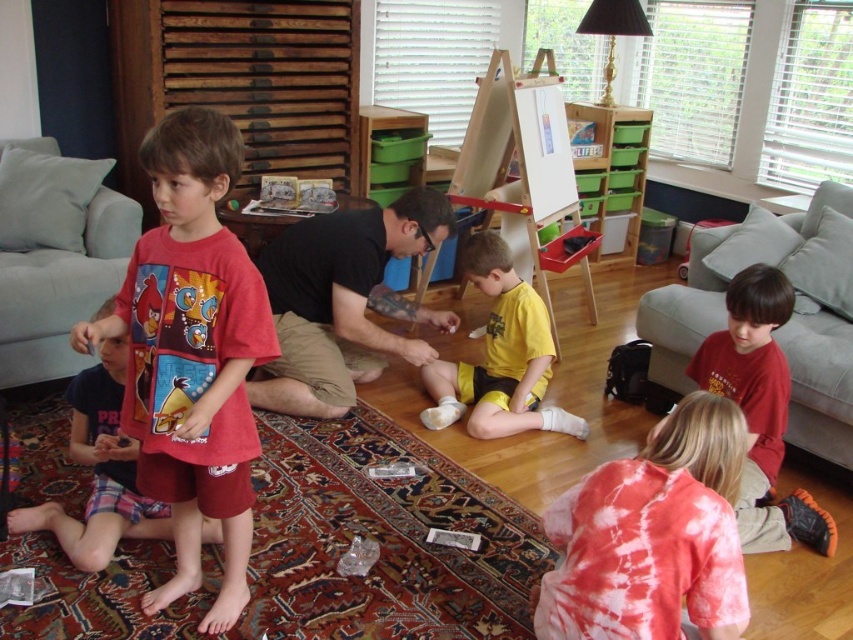
Question: Based on their relative distances, which object is nearer to the matte red t-shirt at center?

Choices:
 (A) angry birds t-shirt at lower left
 (B) wooden easel at center
 (C) tie-dye fabric shirt at lower right

Answer: (A)

Question: Which of the following is the farthest from the observer?

Choices:
 (A) wooden easel at center
 (B) matte red t-shirt at center

Answer: (A)

Question: Does matte red t-shirt at center have a larger size compared to dark red t-shirt at lower right?

Choices:
 (A) no
 (B) yes

Answer: (B)

Question: Which of these objects is positioned farthest from the tie-dye fabric shirt at lower right?

Choices:
 (A) dark red t-shirt at lower right
 (B) yellow matte shorts at center

Answer: (B)

Question: Is matte red t-shirt at center below yellow matte shorts at center?

Choices:
 (A) yes
 (B) no

Answer: (A)

Question: Is matte red t-shirt at center above angry birds t-shirt at lower left?

Choices:
 (A) no
 (B) yes

Answer: (B)